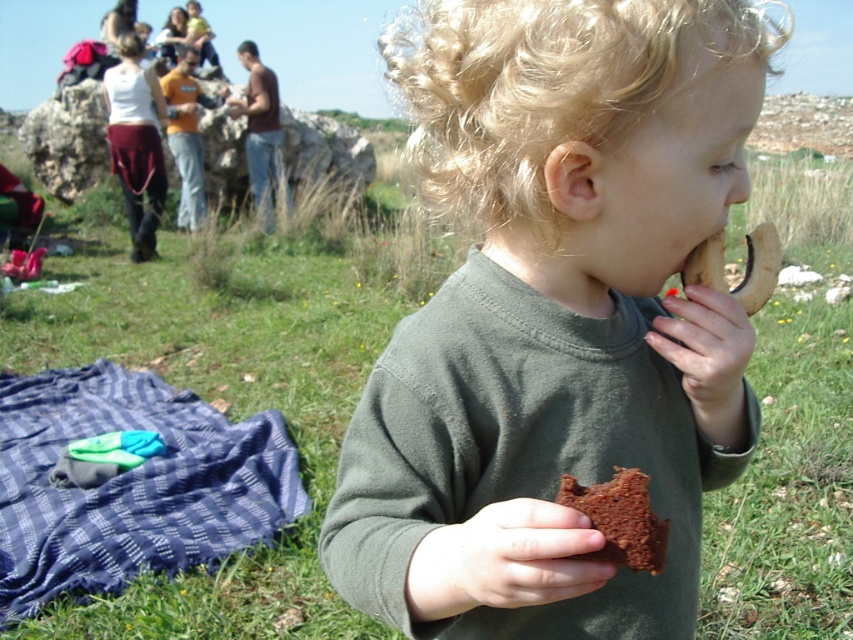
You are taking a photo of the lively outdoor scene. You want to focus on the point closer to you. Which point should you choose between point [141,532] and point [699,260]?

Point [141,532] is further to the camera than point [699,260], so you should choose point [141,532] to focus on the closer point.

You are planning to place the brown crumbly cookie at right on the blue plaid blanket at lower left. Based on the scene description, will the cookie fit on the blanket?

The blue plaid blanket at lower left is wider than the brown crumbly cookie at right, so yes, the cookie will fit on the blanket.

You are a photographer trying to capture the child in the dark green shirt at center without the brown crumbly cookie at right appearing in the frame. Is the cookie currently blocking your view of the child?

The dark green shirt at center is in front of the brown crumbly cookie at right, so the cookie is not blocking the view of the child. You can capture the child without the cookie being in the frame.